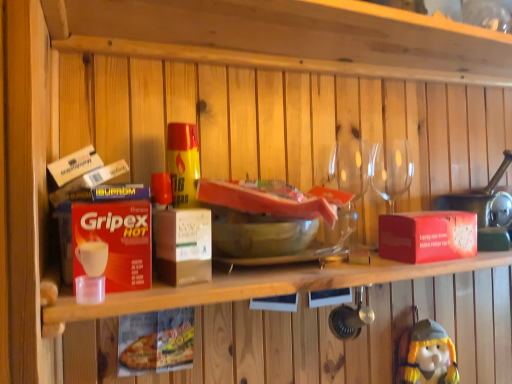
Question: Can you confirm if red matte box at right, the 2th box from the front, is smaller than yellow plush toy at lower right?

Choices:
 (A) no
 (B) yes

Answer: (B)

Question: Is red matte box at right, the 2th box from the front, closer to camera compared to yellow plush toy at lower right?

Choices:
 (A) no
 (B) yes

Answer: (B)

Question: Can you confirm if red matte box at right, positioned as the first box in back-to-front order, is wider than yellow plush toy at lower right?

Choices:
 (A) no
 (B) yes

Answer: (B)

Question: Can you confirm if red matte box at right, positioned as the 1th box in right-to-left order, is taller than yellow plush toy at lower right?

Choices:
 (A) yes
 (B) no

Answer: (B)

Question: Can you confirm if red matte box at right, positioned as the first box in back-to-front order, is shorter than yellow plush toy at lower right?

Choices:
 (A) no
 (B) yes

Answer: (B)

Question: Does red matte box at right, positioned as the 1th box in right-to-left order, have a larger size compared to yellow plush toy at lower right?

Choices:
 (A) no
 (B) yes

Answer: (A)

Question: Could you tell me if transparent glass wine glasses at upper right is turned towards yellow plush toy at lower right?

Choices:
 (A) no
 (B) yes

Answer: (A)

Question: Does transparent glass wine glasses at upper right have a larger size compared to yellow plush toy at lower right?

Choices:
 (A) yes
 (B) no

Answer: (B)

Question: Is transparent glass wine glasses at upper right further to the viewer compared to yellow plush toy at lower right?

Choices:
 (A) yes
 (B) no

Answer: (B)

Question: From the image's perspective, is transparent glass wine glasses at upper right located beneath yellow plush toy at lower right?

Choices:
 (A) yes
 (B) no

Answer: (B)

Question: Considering the relative sizes of transparent glass wine glasses at upper right and yellow plush toy at lower right in the image provided, is transparent glass wine glasses at upper right thinner than yellow plush toy at lower right?

Choices:
 (A) yes
 (B) no

Answer: (B)

Question: Does transparent glass wine glasses at upper right have a smaller size compared to yellow plush toy at lower right?

Choices:
 (A) no
 (B) yes

Answer: (B)

Question: Is yellow plush toy at lower right closer to camera compared to red matte box at right, positioned as the first box in back-to-front order?

Choices:
 (A) no
 (B) yes

Answer: (A)